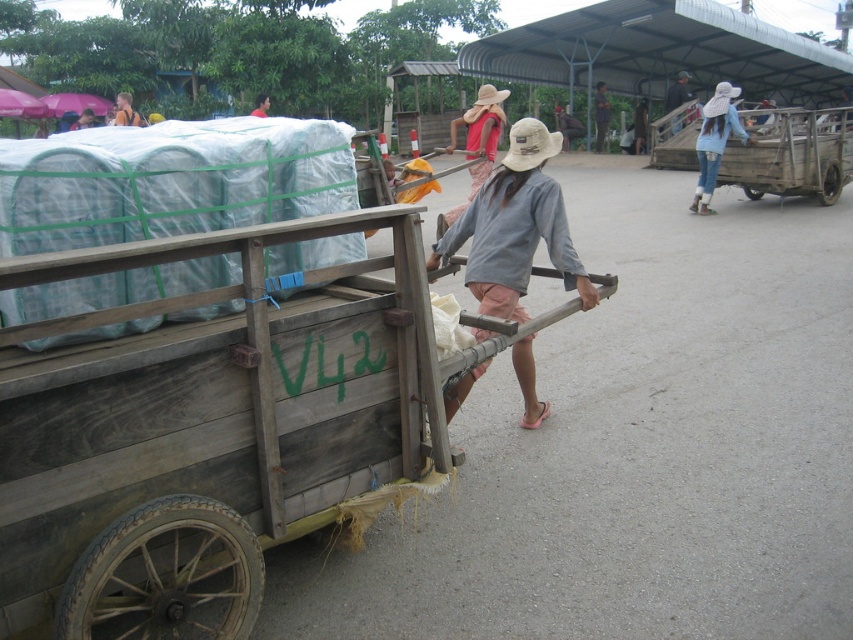
Question: Which object is farther from the camera taking this photo?

Choices:
 (A) matte beige hat at center
 (B) light brown skin at center

Answer: (B)

Question: Which of the following is the farthest from the observer?

Choices:
 (A) (677, 74)
 (B) (601, 147)

Answer: (A)

Question: Is matte beige hat at center behind light brown wooden cart at upper left?

Choices:
 (A) no
 (B) yes

Answer: (A)

Question: Can you confirm if wooden cart at center is positioned to the right of brown woven hat at center?

Choices:
 (A) yes
 (B) no

Answer: (B)

Question: Which object is closer to the camera taking this photo?

Choices:
 (A) wooden cart at center
 (B) light brown skin at center

Answer: (A)

Question: Does dark gray shirt at center appear on the left side of light brown skin at center?

Choices:
 (A) yes
 (B) no

Answer: (B)